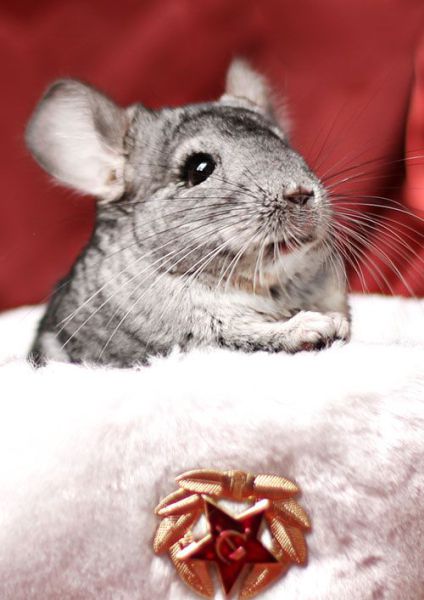
You are a GUI agent. You are given a task and a screenshot of the screen. Output one action in this format:
    pyautogui.click(x=<x>, y=<y>)
    Task: Click on the gold wreath
    The height and width of the screenshot is (600, 424).
    Given the screenshot: What is the action you would take?
    pyautogui.click(x=294, y=526)